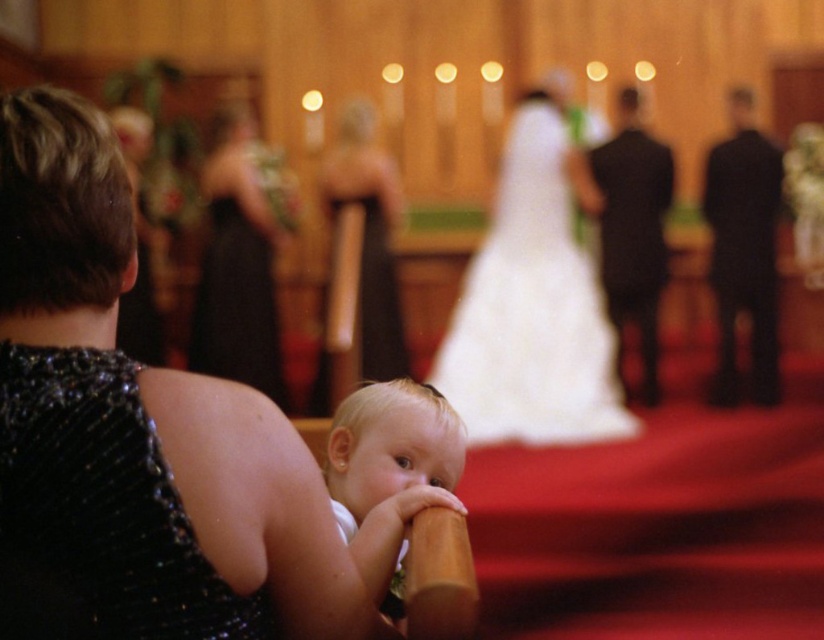
You are a photographer at the wedding. You need to adjust the camera focus so that both the sparkly black dress at lower left and the smooth white baby at center are in focus. Which object should you focus on first to ensure both are sharp?

You should focus on the sparkly black dress at lower left first because it is larger in size compared to the smooth white baby at center, so focusing on the larger object will help ensure both are in focus.